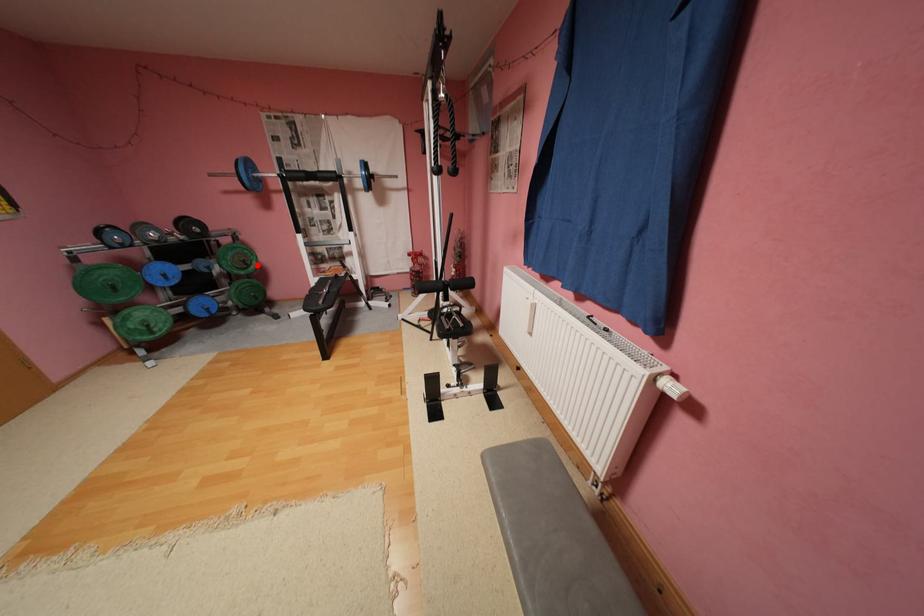
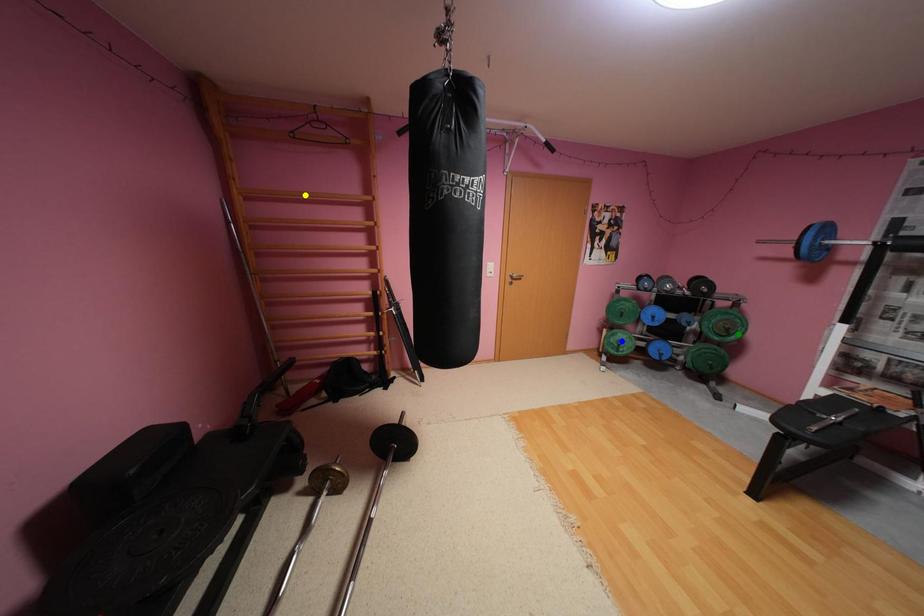
Question: I am providing you with two images of the same scene from different viewpoints. A red point is marked on the first image. You are given multiple points on the second image. Which point in image 2 represents the same 3d spot as the red point in image 1?

Choices:
 (A) green point
 (B) yellow point
 (C) blue point

Answer: (A)